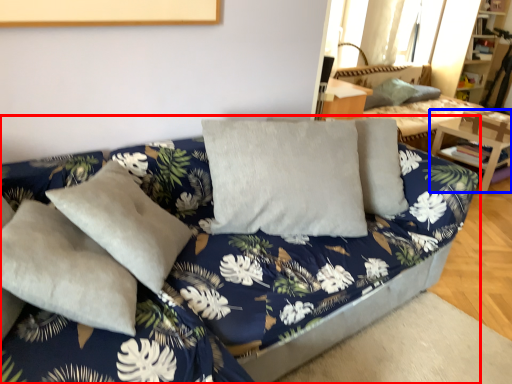
Question: Among these objects, which one is farthest to the camera, studio couch (highlighted by a red box) or table (highlighted by a blue box)?

Choices:
 (A) studio couch
 (B) table

Answer: (B)